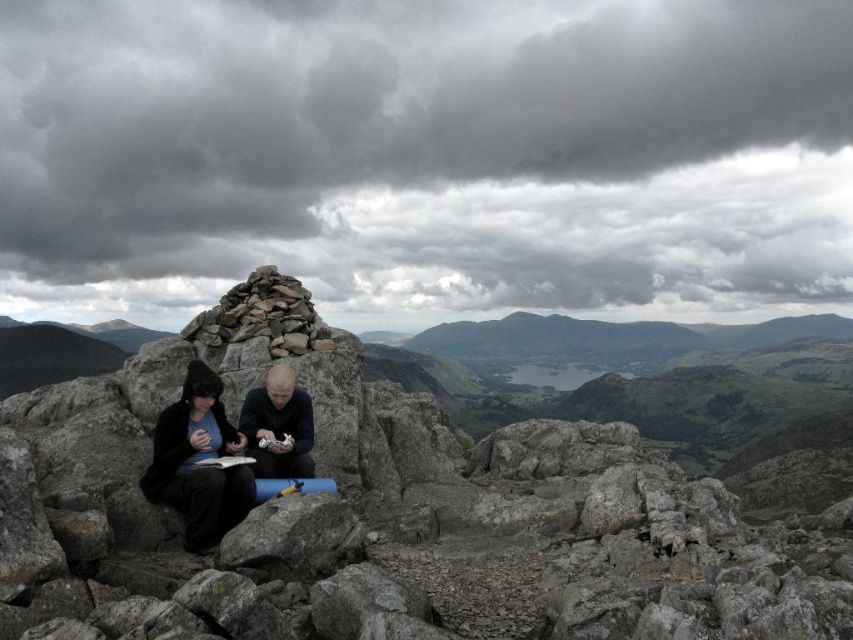
You are a hiker standing at the base of the mountain, looking at the scene. You want to toss a small pebble to the matte black jacket at center. Is it within a 60 feet throwing distance?

The matte black jacket at center is 57.13 feet away from viewer, so yes, it is within a 60 feet throwing distance.

You are a hiker trying to place a map on the ground between the rough stone cairn at center and the matte black jacket at center. Since the map is small, you want to ensure it won

The rough stone cairn at center is closer to the viewer than matte black jacket at center, so placing the map between them would require positioning it closer to the rough stone cairn at center to ensure it is visible and accessible.

You are a hiker trying to place a map on the ground between the rough stone cairn at center and the matte black jacket at center. Which object should you place the map closer to if you want it to be near the left side of the scene?

The matte black jacket at center is to the left of the rough stone cairn at center, so placing the map closer to the matte black jacket at center will position it near the left side of the scene.